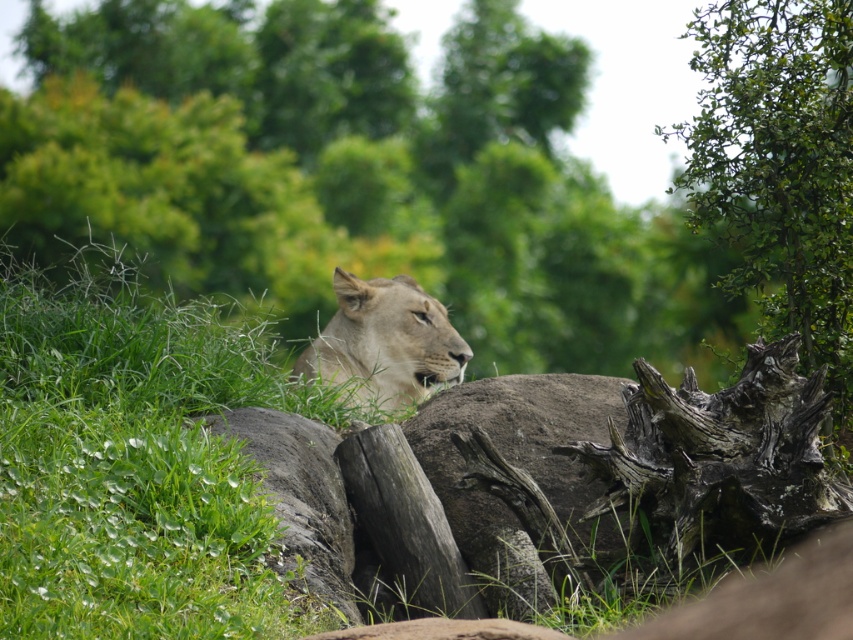
Does green leafy tree at right lie in front of light brown fur lion at center?

That is True.

Between green leafy tree at right and light brown fur lion at center, which one appears on the right side from the viewer's perspective?

green leafy tree at right

Which is behind, point (701, 225) or point (396, 307)?

Point (396, 307)

This screenshot has width=853, height=640. I want to click on green leafy tree at right, so click(780, 170).